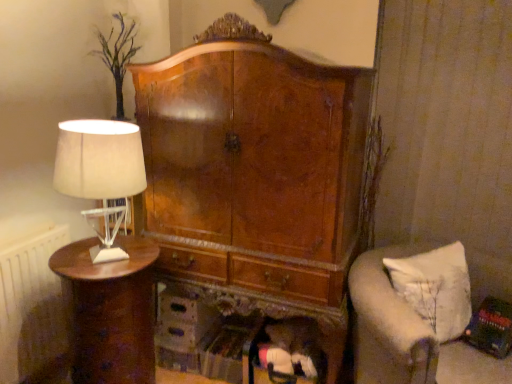
Question: From the image's perspective, is shiny brown wood nightstand at left above or below white fabric lampshade at left?

Choices:
 (A) below
 (B) above

Answer: (A)

Question: Considering the relative positions of shiny brown wood nightstand at left and white fabric lampshade at left in the image provided, is shiny brown wood nightstand at left to the left or to the right of white fabric lampshade at left?

Choices:
 (A) left
 (B) right

Answer: (A)

Question: Considering the real-world distances, which object is closest to the shiny brown wood nightstand at left?

Choices:
 (A) white fabric cushion at lower right
 (B) white radiator at left
 (C) white fabric lampshade at left

Answer: (C)

Question: Estimate the real-world distances between objects in this image. Which object is closer to the white fabric lampshade at left?

Choices:
 (A) shiny brown wood nightstand at left
 (B) white fabric cushion at lower right
 (C) white radiator at left

Answer: (A)